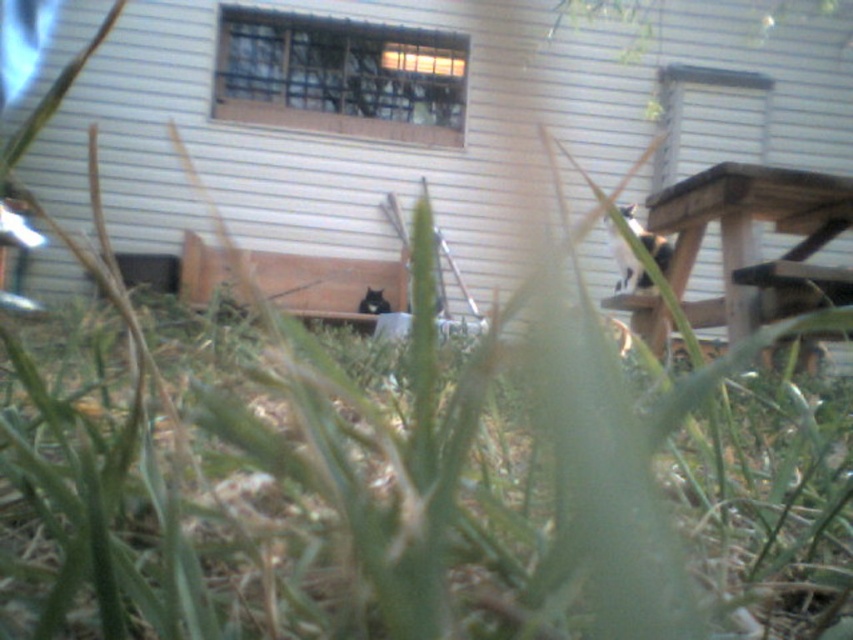
Which of these two, white fur cat at upper right or black fur cat at center, stands taller?

With more height is white fur cat at upper right.

Consider the image. Who is higher up, white fur cat at upper right or black fur cat at center?

Positioned higher is white fur cat at upper right.

What do you see at coordinates (625, 262) in the screenshot?
I see `white fur cat at upper right` at bounding box center [625, 262].

Where is `white fur cat at upper right`? The image size is (853, 640). white fur cat at upper right is located at coordinates (625, 262).